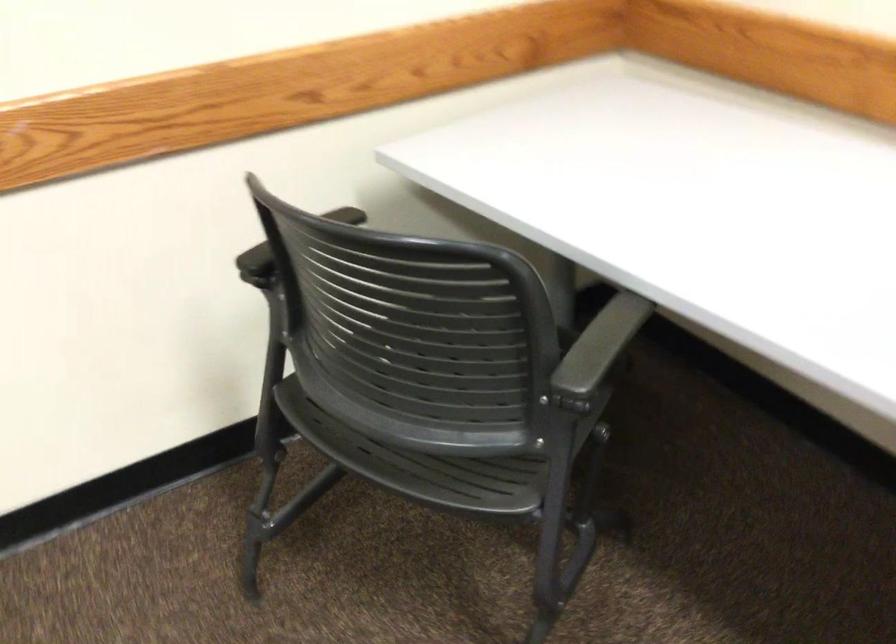
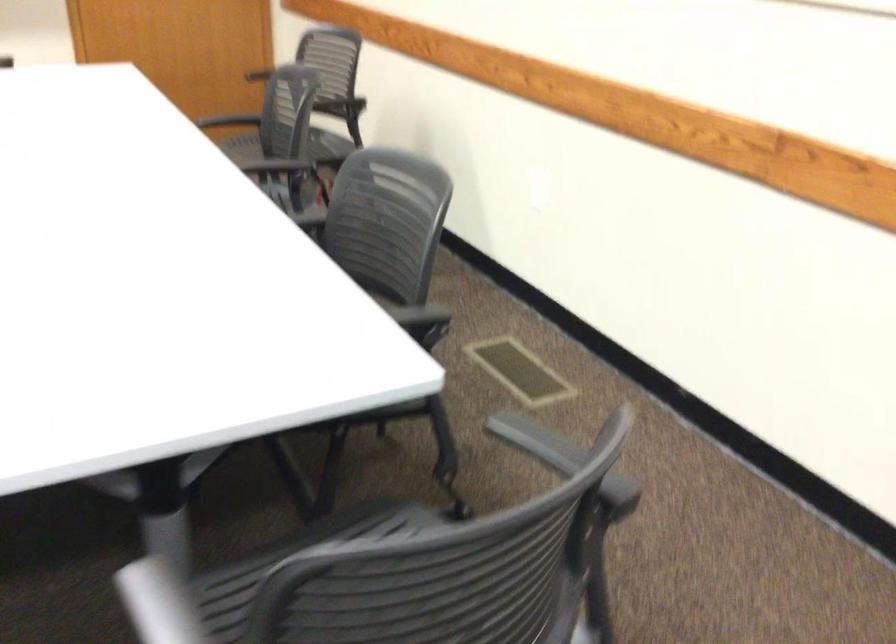
Based on the continuous images, in which direction is the camera rotating?

The rotation direction of the camera is left-down.